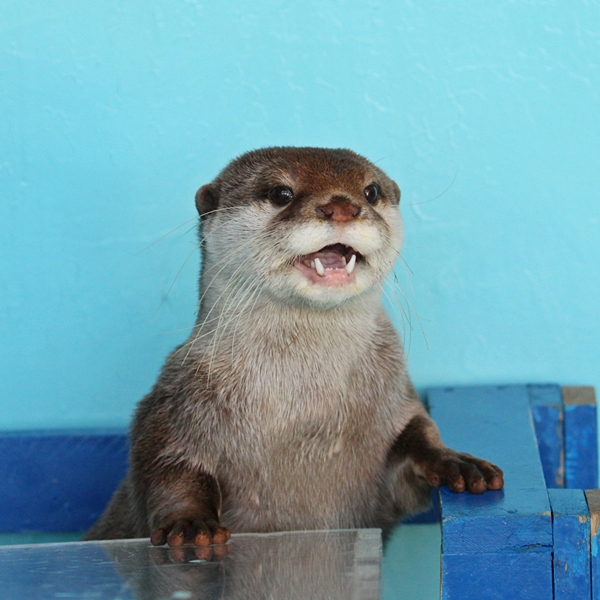
You are a GUI agent. You are given a task and a screenshot of the screen. Output one action in this format:
    pyautogui.click(x=<x>, y=<y>)
    Task: Click on the glass
    The height and width of the screenshot is (600, 600).
    Given the screenshot: What is the action you would take?
    pyautogui.click(x=140, y=598)